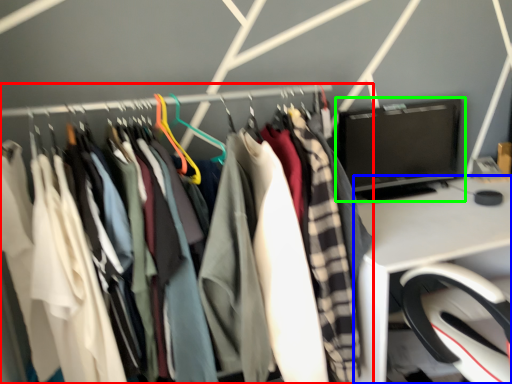
Question: Which is farther away from closet (highlighted by a red box)? desk (highlighted by a blue box) or computer monitor (highlighted by a green box)?

Choices:
 (A) desk
 (B) computer monitor

Answer: (B)